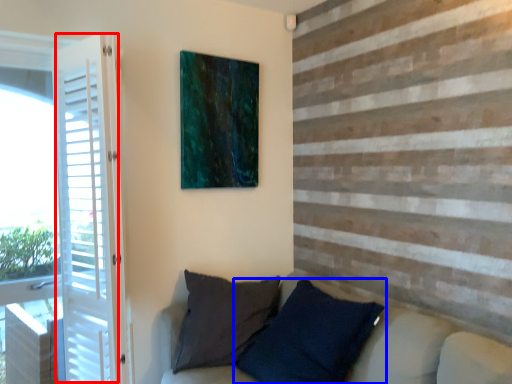
Question: Which point is closer to the camera, screen door (highlighted by a red box) or pillow (highlighted by a blue box)?

Choices:
 (A) screen door
 (B) pillow

Answer: (B)